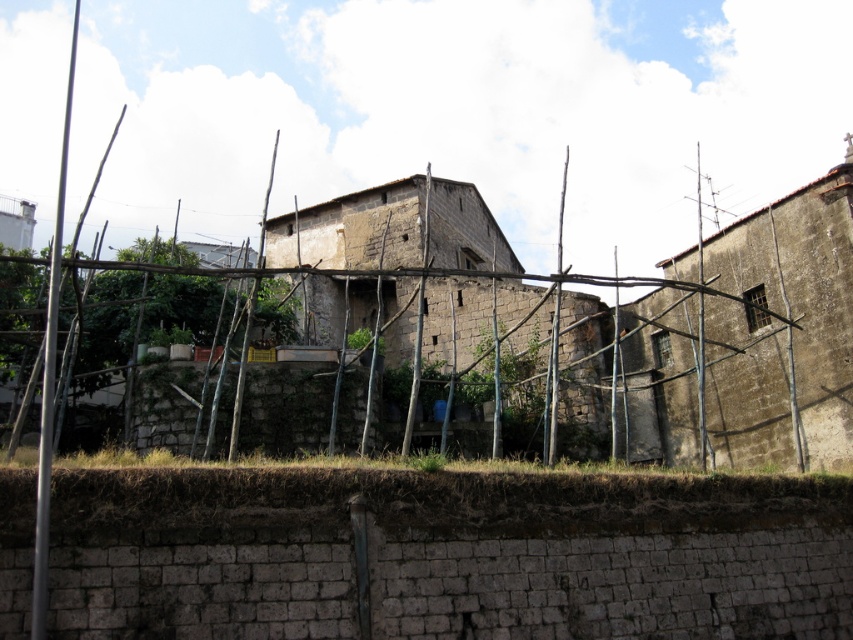
You are a construction worker who needs to move a heavy beam that is 70 feet long from the rustic stone hut at right to the weathered stone hut at center. Can you move the beam without bending it?

The distance between the rustic stone hut at right and the weathered stone hut at center is 71.35 feet. Since the beam is 70 feet long, it can be moved in one piece without bending because the distance is slightly longer than the beam.